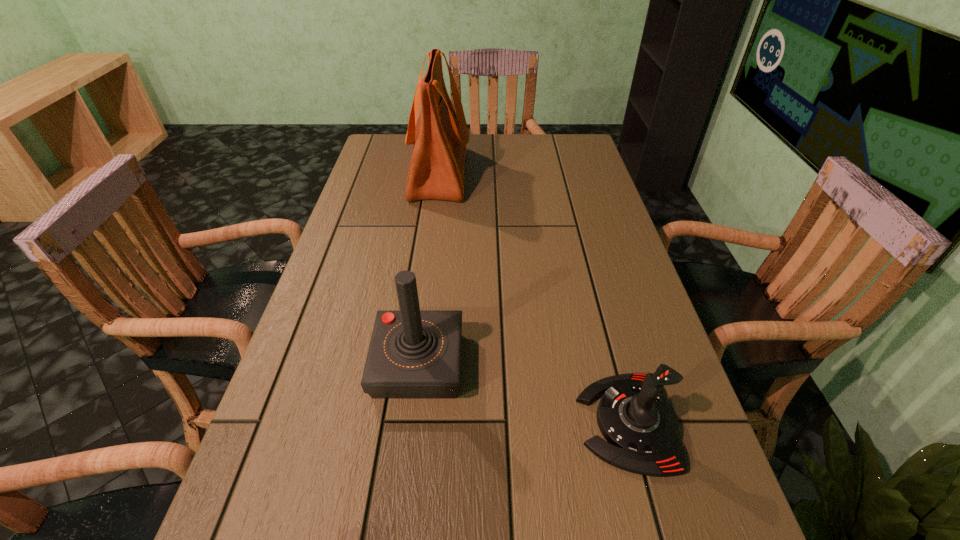
Identify the location of the farthest object. The image size is (960, 540). (440, 136).

At what (x,y) coordinates should I click in order to perform the action: click on shopping bag. Please return your answer as a coordinate pair (x, y). The width and height of the screenshot is (960, 540). Looking at the image, I should click on (440, 136).

Where is `the second shortest object`? The image size is (960, 540). the second shortest object is located at coordinates (413, 354).

I want to click on the taller joystick, so click(413, 354).

This screenshot has width=960, height=540. In order to click on the rightmost object in this screenshot , I will do `click(641, 428)`.

At what (x,y) coordinates should I click in order to perform the action: click on the shorter joystick. Please return your answer as a coordinate pair (x, y). This screenshot has width=960, height=540. Looking at the image, I should click on (641, 428).

This screenshot has height=540, width=960. I want to click on free point located 0.180m on the front pocket of the farthest object, so click(525, 174).

Where is `vacant space located on the rectangular base of the taller joystick`? The height and width of the screenshot is (540, 960). vacant space located on the rectangular base of the taller joystick is located at coordinates (403, 485).

The height and width of the screenshot is (540, 960). Find the location of `vacant space located 0.290m on the handle side of the shorter joystick`. vacant space located 0.290m on the handle side of the shorter joystick is located at coordinates (419, 423).

The width and height of the screenshot is (960, 540). I want to click on free space located on the handle side of the shorter joystick, so click(x=413, y=423).